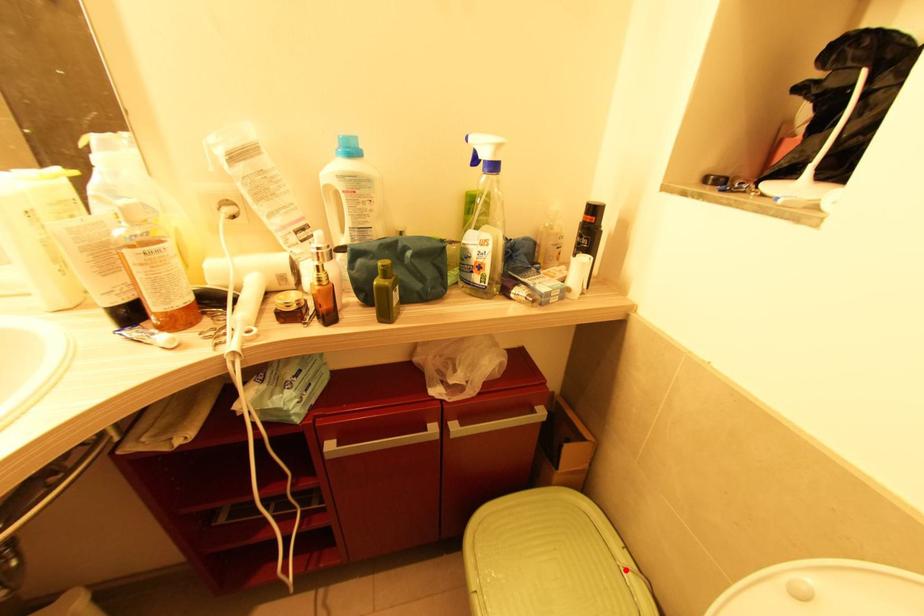
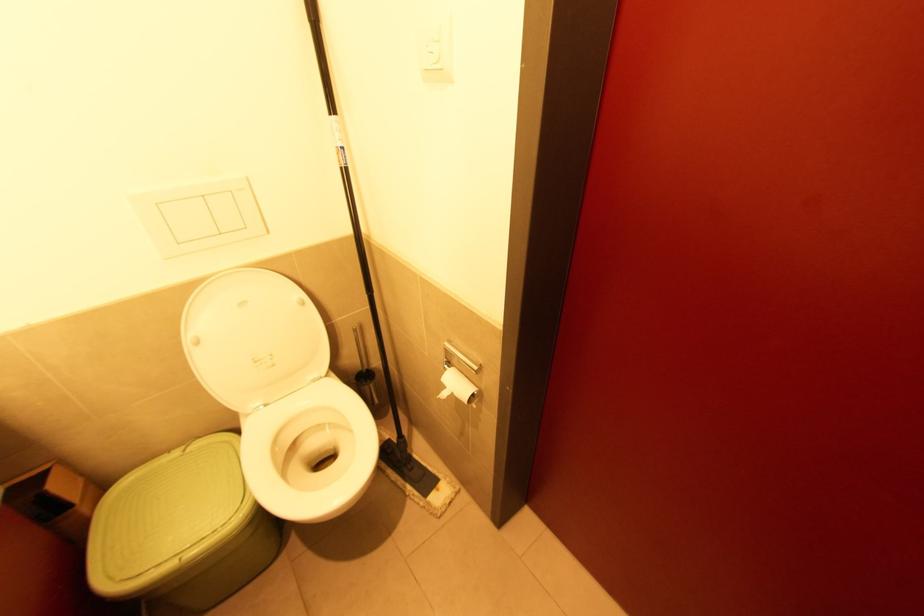
The point at the highlighted location is marked in the first image. Where is the corresponding point in the second image?

(187, 452)